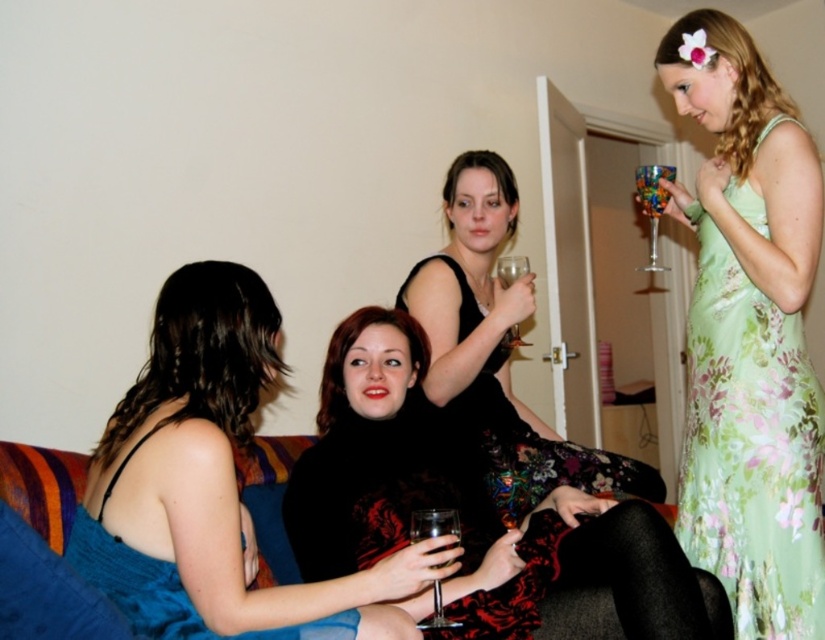
Describe the element at coordinates (653, 188) in the screenshot. This screenshot has height=640, width=825. I see `translucent glass at upper right` at that location.

Is point (637, 168) farther from camera compared to point (500, 260)?

Yes, point (637, 168) is behind point (500, 260).

Is point (649, 188) positioned in front of point (503, 276)?

No, it is behind (503, 276).

I want to click on translucent glass at upper right, so click(653, 188).

Looking at this image, between blue satin dress at center and floral silk dress at upper right, which one has less height?

blue satin dress at center is shorter.

Does blue satin dress at center appear on the left side of floral silk dress at upper right?

Yes, blue satin dress at center is to the left of floral silk dress at upper right.

The width and height of the screenshot is (825, 640). Describe the element at coordinates (210, 484) in the screenshot. I see `blue satin dress at center` at that location.

Identify the location of blue satin dress at center. (210, 484).

Is floral silk dress at upper right taller than blue satin dress at lower left?

Yes, floral silk dress at upper right is taller than blue satin dress at lower left.

Does point (781, 465) come in front of point (333, 628)?

No, it is not.

What are the coordinates of `floral silk dress at upper right` in the screenshot? It's located at (752, 449).